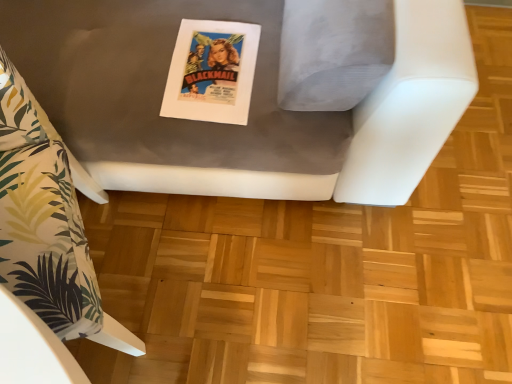
Question: From the image's perspective, is white fabric pillow at left, the second furniture from the right, on matte gray cushion at center, the 2th furniture in the left-to-right sequence?

Choices:
 (A) yes
 (B) no

Answer: (B)

Question: Does white fabric pillow at left, which is counted as the first furniture, starting from the left, have a lesser height compared to matte gray cushion at center, which is counted as the 1th furniture, starting from the right?

Choices:
 (A) no
 (B) yes

Answer: (B)

Question: Considering the relative sizes of white fabric pillow at left, the second furniture from the right, and matte gray cushion at center, the 2th furniture in the left-to-right sequence, in the image provided, is white fabric pillow at left, the second furniture from the right, thinner than matte gray cushion at center, the 2th furniture in the left-to-right sequence,?

Choices:
 (A) yes
 (B) no

Answer: (A)

Question: Is white fabric pillow at left, which is counted as the first furniture, starting from the left, turned away from matte gray cushion at center, which is counted as the 1th furniture, starting from the right?

Choices:
 (A) no
 (B) yes

Answer: (B)

Question: From a real-world perspective, is white fabric pillow at left, which is counted as the first furniture, starting from the left, positioned over matte gray cushion at center, which is counted as the 1th furniture, starting from the right, based on gravity?

Choices:
 (A) no
 (B) yes

Answer: (A)

Question: Would you consider white fabric pillow at left, the second furniture from the right, to be distant from matte gray cushion at center, the 2th furniture in the left-to-right sequence?

Choices:
 (A) no
 (B) yes

Answer: (A)

Question: From the image's perspective, would you say matte gray cushion at center, which is counted as the 1th furniture, starting from the right, is shown under matte paper poster at center?

Choices:
 (A) no
 (B) yes

Answer: (A)

Question: Is matte gray cushion at center, which is counted as the 1th furniture, starting from the right, not within matte paper poster at center?

Choices:
 (A) no
 (B) yes

Answer: (B)

Question: From a real-world perspective, is matte gray cushion at center, the 2th furniture in the left-to-right sequence, beneath matte paper poster at center?

Choices:
 (A) no
 (B) yes

Answer: (A)

Question: Considering the relative sizes of matte gray cushion at center, which is counted as the 1th furniture, starting from the right, and matte paper poster at center in the image provided, is matte gray cushion at center, which is counted as the 1th furniture, starting from the right, bigger than matte paper poster at center?

Choices:
 (A) yes
 (B) no

Answer: (A)

Question: Does matte gray cushion at center, the 2th furniture in the left-to-right sequence, come in front of matte paper poster at center?

Choices:
 (A) yes
 (B) no

Answer: (A)

Question: Is matte gray cushion at center, the 2th furniture in the left-to-right sequence, positioned behind matte paper poster at center?

Choices:
 (A) no
 (B) yes

Answer: (A)

Question: Is the surface of white fabric pillow at left, the second furniture from the right, in direct contact with matte paper poster at center?

Choices:
 (A) no
 (B) yes

Answer: (A)